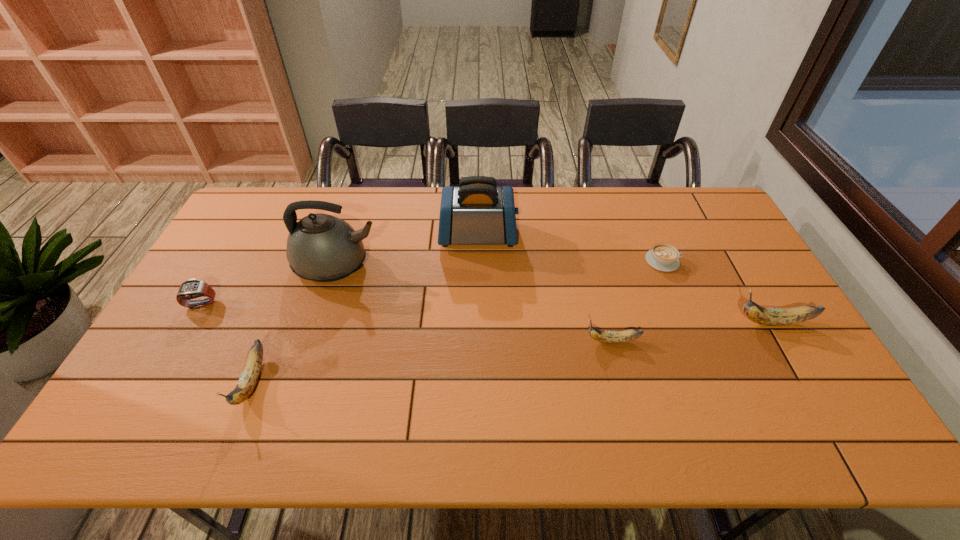
In the image, there is a desktop. Identify the location of vacant space at the far left corner. The height and width of the screenshot is (540, 960). (260, 207).

Locate an element on the screen. The width and height of the screenshot is (960, 540). vacant space at the far right corner of the desktop is located at coordinates (695, 212).

This screenshot has height=540, width=960. I want to click on unoccupied area between the kettle and the second farthest banana, so click(x=475, y=303).

Identify the location of vacant area that lies between the kettle and the fifth farthest object. (x=555, y=294).

Find the location of a particular element. This screenshot has height=540, width=960. free spot between the rightmost banana and the shortest object is located at coordinates (718, 292).

This screenshot has height=540, width=960. Identify the location of free space that is in between the second shortest banana and the kettle. (295, 323).

Locate an element on the screen. This screenshot has width=960, height=540. empty space that is in between the cappuccino and the third nearest object is located at coordinates (718, 292).

I want to click on vacant area that lies between the leftmost object and the kettle, so click(x=269, y=285).

Find the location of a particular element. The image size is (960, 540). free space between the rightmost object and the kettle is located at coordinates (555, 294).

What are the coordinates of `free space between the kettle and the shortest banana` in the screenshot? It's located at (475, 303).